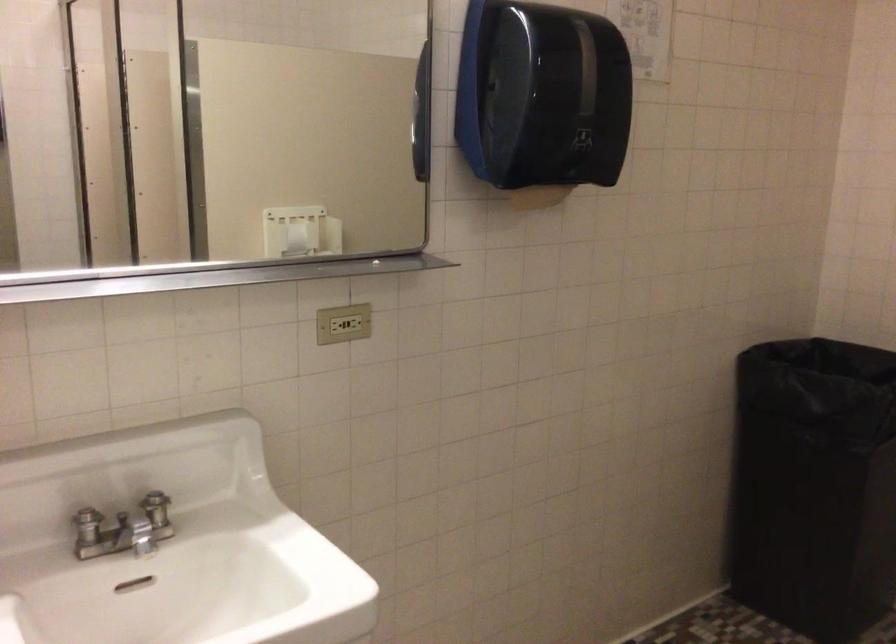
Find the location of a particular element. The width and height of the screenshot is (896, 644). black trash can is located at coordinates (814, 486).